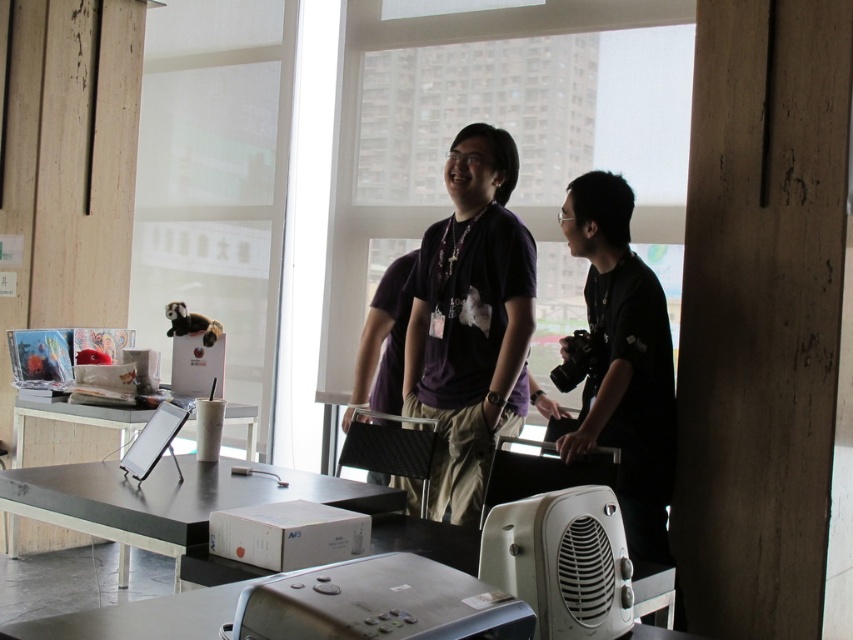
You are setting up a presentation and need to place both the metallic gray projector at center and the black glossy tablet at center on a narrow shelf. Based on their sizes, which one can you fit first without exceeding the shelf width?

The metallic gray projector at center is thinner than the black glossy tablet at center, so it can be placed first on the shelf.

You are sitting at the black table and want to reach both the metallic gray projector at center and the black glossy tablet at center. Which one can you grab first without moving your chair?

The metallic gray projector at center is closer to the viewer, so you can grab it first without moving your chair.

You are organizing items on a table and need to place a new item between the purple matte shirt at center and the metallic gray projector at center. Based on their current positions, where should you place the new item?

The purple matte shirt at center is to the right of the metallic gray projector at center, so you should place the new item between them by positioning it to the right of the metallic gray projector at center and to the left of the purple matte shirt at center.